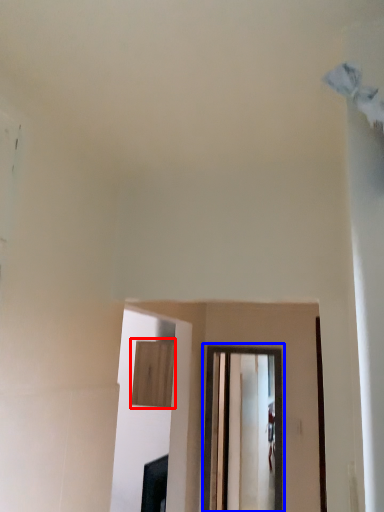
Question: Which of the following is the farthest to the observer, cabinetry (highlighted by a red box) or window (highlighted by a blue box)?

Choices:
 (A) cabinetry
 (B) window

Answer: (A)